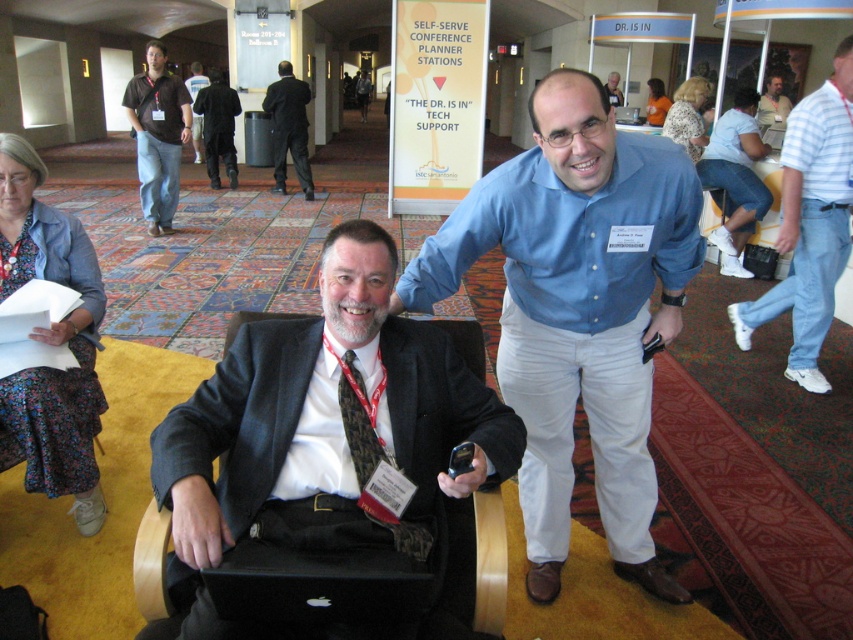
Which of these two, floral fabric skirt at lower left or dark blue shirt at center, stands taller?

With more height is floral fabric skirt at lower left.

Does floral fabric skirt at lower left appear on the right side of dark blue shirt at center?

Indeed, floral fabric skirt at lower left is positioned on the right side of dark blue shirt at center.

Identify the location of floral fabric skirt at lower left. (50, 342).

Does floral-patterned blouse at upper center appear on the left side of light brown leather jacket at upper center?

Correct, you'll find floral-patterned blouse at upper center to the left of light brown leather jacket at upper center.

Which of these two, floral-patterned blouse at upper center or light brown leather jacket at upper center, stands shorter?

floral-patterned blouse at upper center is shorter.

Is point (663, 131) farther from viewer compared to point (780, 76)?

No, it is in front of (780, 76).

This screenshot has height=640, width=853. I want to click on floral-patterned blouse at upper center, so tap(689, 115).

Is point (770, 96) less distant than point (199, 154)?

Yes, it is.

From the picture: Is light brown leather jacket at upper center positioned behind dark blue shirt at center?

That is False.

Where is `light brown leather jacket at upper center`? Image resolution: width=853 pixels, height=640 pixels. light brown leather jacket at upper center is located at coordinates (773, 106).